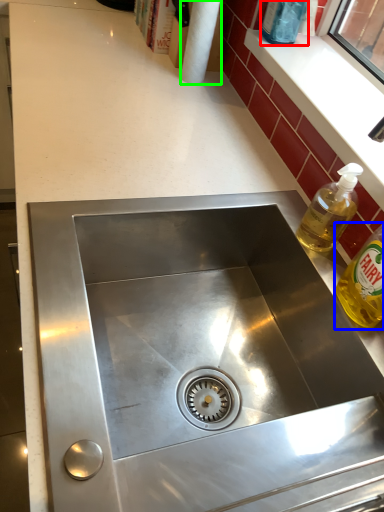
Question: Which is nearer to the bottle (highlighted by a red box)? bottle (highlighted by a blue box) or paper towel (highlighted by a green box).

Choices:
 (A) bottle
 (B) paper towel

Answer: (B)